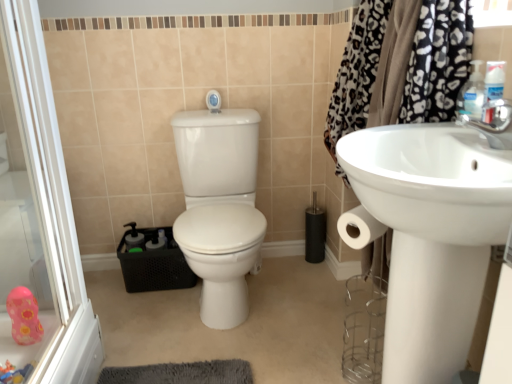
Describe the element at coordinates (435, 62) in the screenshot. I see `black leopard print fabric at upper right` at that location.

In order to face black leopard print fabric at upper right, should I rotate leftwards or rightwards?

Turn right by 18.236 degrees to look at black leopard print fabric at upper right.

What do you see at coordinates (234, 328) in the screenshot?
I see `pink rubber duck at lower left` at bounding box center [234, 328].

Find the location of a particular element. Image resolution: width=512 pixels, height=384 pixels. pink rubber duck at lower left, marked as the second toy in a bottom-to-top arrangement is located at coordinates (24, 316).

Is white glossy sink at right oriented towards black leopard print fabric at upper right?

No, white glossy sink at right is not facing towards black leopard print fabric at upper right.

Which point is more distant from viewer, (x=425, y=228) or (x=438, y=27)?

The point (x=438, y=27) is more distant.

Between white glossy sink at right and black leopard print fabric at upper right, which one appears on the right side from the viewer's perspective?

white glossy sink at right is more to the right.

Do you think white glossy sink at right is within black leopard print fabric at upper right, or outside of it?

white glossy sink at right lies outside black leopard print fabric at upper right.

Can you confirm if pink rubber duck at lower left is shorter than black leopard print fabric at upper right?

Yes, pink rubber duck at lower left is shorter than black leopard print fabric at upper right.

From the image's perspective, is pink rubber duck at lower left above or below black leopard print fabric at upper right?

pink rubber duck at lower left is below black leopard print fabric at upper right.

Based on the photo, is pink rubber duck at lower left completely or partially outside of black leopard print fabric at upper right?

Yes.

Could you tell me if pink rubber duck at lower left is facing black leopard print fabric at upper right?

No.

Does white glossy sink at right have a lesser height compared to white glossy shower at upper center?

No.

Can you confirm if white glossy sink at right is wider than white glossy shower at upper center?

Correct, the width of white glossy sink at right exceeds that of white glossy shower at upper center.

Which is behind, point (388, 196) or point (219, 99)?

The point (219, 99) is more distant.

Find the location of a particular element. sink that appears below the white glossy shower at upper center (from a real-world perspective) is located at coordinates (433, 232).

Is point (36, 317) positioned before point (286, 311)?

Yes, point (36, 317) is closer to viewer.

Image resolution: width=512 pixels, height=384 pixels. Find the location of `plain that is on the right side of pink rubber duck at lower left, the second toy when ordered from front to back`. plain that is on the right side of pink rubber duck at lower left, the second toy when ordered from front to back is located at coordinates (234, 328).

Could you tell me if pink rubber duck at lower left, which is the 1th toy from back to front, is facing pink rubber duck at lower left?

No.

In the image, is pink rubber duck at lower left, marked as the second toy in a bottom-to-top arrangement, positioned in front of or behind pink rubber duck at lower left?

In the image, pink rubber duck at lower left, marked as the second toy in a bottom-to-top arrangement, appears behind pink rubber duck at lower left.

Can you see plastic pink toy at lower left, which is the 1th toy from front to back, touching white glossy sink at right?

No, plastic pink toy at lower left, which is the 1th toy from front to back, is not touching white glossy sink at right.

From the image's perspective, which object appears higher, plastic pink toy at lower left, placed as the second toy when sorted from top to bottom, or white glossy sink at right?

white glossy sink at right is shown above in the image.

Where is `sink lying on the right of plastic pink toy at lower left, which is the 2th toy in back-to-front order`? This screenshot has width=512, height=384. sink lying on the right of plastic pink toy at lower left, which is the 2th toy in back-to-front order is located at coordinates (433, 232).

Is plastic pink toy at lower left, which is the 1th toy from front to back, inside the boundaries of white glossy sink at right, or outside?

plastic pink toy at lower left, which is the 1th toy from front to back, exists outside the volume of white glossy sink at right.

Consider the image. Considering the sizes of objects black leopard print fabric at upper right and white glossy shower at upper center in the image provided, who is taller, black leopard print fabric at upper right or white glossy shower at upper center?

Standing taller between the two is black leopard print fabric at upper right.

Is point (397, 79) behind point (212, 91)?

No, (397, 79) is closer to viewer.

Can you confirm if black leopard print fabric at upper right is wider than white glossy shower at upper center?

Yes, black leopard print fabric at upper right is wider than white glossy shower at upper center.

This screenshot has width=512, height=384. I want to click on shower that is behind the black leopard print fabric at upper right, so click(x=213, y=101).

Visually, is black leopard print fabric at upper right positioned to the left or to the right of pink rubber duck at lower left, the second toy when ordered from front to back?

black leopard print fabric at upper right is positioned on pink rubber duck at lower left, the second toy when ordered from front to back,'s right side.

Considering the positions of objects black leopard print fabric at upper right and pink rubber duck at lower left, marked as the second toy in a bottom-to-top arrangement, in the image provided, who is in front, black leopard print fabric at upper right or pink rubber duck at lower left, marked as the second toy in a bottom-to-top arrangement,?

Positioned in front is black leopard print fabric at upper right.

From the image's perspective, does black leopard print fabric at upper right appear higher than pink rubber duck at lower left, the first toy viewed from the top?

Correct, black leopard print fabric at upper right appears higher than pink rubber duck at lower left, the first toy viewed from the top, in the image.

Is black leopard print fabric at upper right bigger than pink rubber duck at lower left, the first toy viewed from the top?

Indeed, black leopard print fabric at upper right has a larger size compared to pink rubber duck at lower left, the first toy viewed from the top.

The width and height of the screenshot is (512, 384). Identify the location of shower curtain above the white glossy sink at right (from the image's perspective). (435, 62).

The image size is (512, 384). I want to click on plain to the left of black leopard print fabric at upper right, so click(234, 328).

From the image, which object appears to be farther from white glossy sink at right, white glossy toilet at center or plastic pink toy at lower left, which is the 1th toy from front to back?

Among the two, plastic pink toy at lower left, which is the 1th toy from front to back, is located further to white glossy sink at right.

Looking at the image, which one is located further to white glossy shower at upper center, black leopard print fabric at upper right or plastic pink toy at lower left, which is the 1th toy from front to back?

The object further to white glossy shower at upper center is plastic pink toy at lower left, which is the 1th toy from front to back.

Based on their spatial positions, is pink rubber duck at lower left, the first toy viewed from the top, or black leopard print fabric at upper right further from pink rubber duck at lower left?

black leopard print fabric at upper right.

In the scene shown: When comparing their distances from white glossy sink at right, does white glossy toilet at center or black leopard print fabric at upper right seem further?

white glossy toilet at center lies further to white glossy sink at right than the other object.

Looking at the image, which one is located closer to white glossy sink at right, white glossy toilet at center or pink rubber duck at lower left?

Based on the image, white glossy toilet at center appears to be nearer to white glossy sink at right.

When comparing their distances from white glossy shower at upper center, does pink rubber duck at lower left, the second toy when ordered from front to back, or pink rubber duck at lower left seem further?

The object further to white glossy shower at upper center is pink rubber duck at lower left, the second toy when ordered from front to back.

Looking at the image, which one is located further to pink rubber duck at lower left, the first toy viewed from the top, white glossy sink at right or black leopard print fabric at upper right?

Among the two, black leopard print fabric at upper right is located further to pink rubber duck at lower left, the first toy viewed from the top.

Looking at the image, which one is located further to white glossy toilet at center, pink rubber duck at lower left or black leopard print fabric at upper right?

black leopard print fabric at upper right is further to white glossy toilet at center.

At what (x,y) coordinates should I click in order to perform the action: click on shower between plastic pink toy at lower left, placed as the first toy when sorted from bottom to top, and white glossy sink at right, in the horizontal direction. Please return your answer as a coordinate pair (x, y). The width and height of the screenshot is (512, 384). Looking at the image, I should click on (213, 101).

You are a GUI agent. You are given a task and a screenshot of the screen. Output one action in this format:
    pyautogui.click(x=<x>, y=<y>)
    Task: Click on the shower curtain between pink rubber duck at lower left and white glossy sink at right from left to right
    
    Given the screenshot: What is the action you would take?
    pyautogui.click(x=435, y=62)

This screenshot has width=512, height=384. I want to click on toy between plastic pink toy at lower left, placed as the second toy when sorted from top to bottom, and white glossy toilet at center from left to right, so click(x=24, y=316).

Where is `sit between black leopard print fabric at upper right and white glossy shower at upper center in the front-back direction`? sit between black leopard print fabric at upper right and white glossy shower at upper center in the front-back direction is located at coordinates (219, 207).